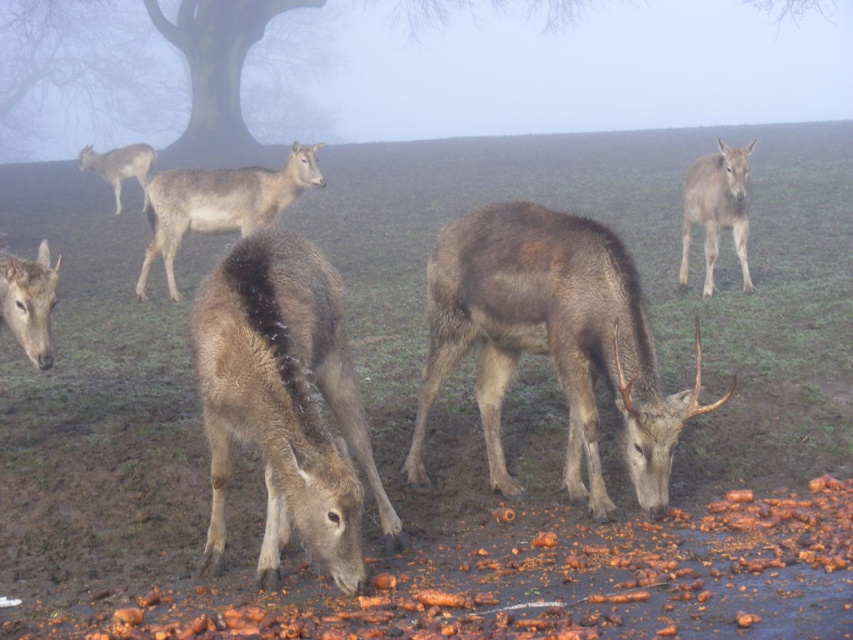
Is brown fur deer at lower left taller than gray fur deer at upper left?

No, brown fur deer at lower left is not taller than gray fur deer at upper left.

Image resolution: width=853 pixels, height=640 pixels. Describe the element at coordinates (28, 301) in the screenshot. I see `brown fur deer at lower left` at that location.

Is point (33, 323) farther from viewer compared to point (129, 163)?

No, it is in front of (129, 163).

Locate an element on the screen. The height and width of the screenshot is (640, 853). brown fur deer at lower left is located at coordinates (28, 301).

Is brown furry deer at center taller than gray matte deer at center?

No.

Which is above, brown furry deer at center or gray matte deer at center?

gray matte deer at center is higher up.

Between point (322, 304) and point (282, 177), which one is positioned behind?

The point (282, 177) is behind.

Identify the location of brown furry deer at center. (283, 401).

What do you see at coordinates (219, 204) in the screenshot?
I see `gray matte deer at center` at bounding box center [219, 204].

Between gray matte deer at center and gray fur deer at upper left, which one appears on the left side from the viewer's perspective?

gray fur deer at upper left is more to the left.

Between point (291, 177) and point (94, 168), which one is positioned in front?

Point (291, 177)

Identify the location of gray matte deer at center. This screenshot has width=853, height=640. (219, 204).